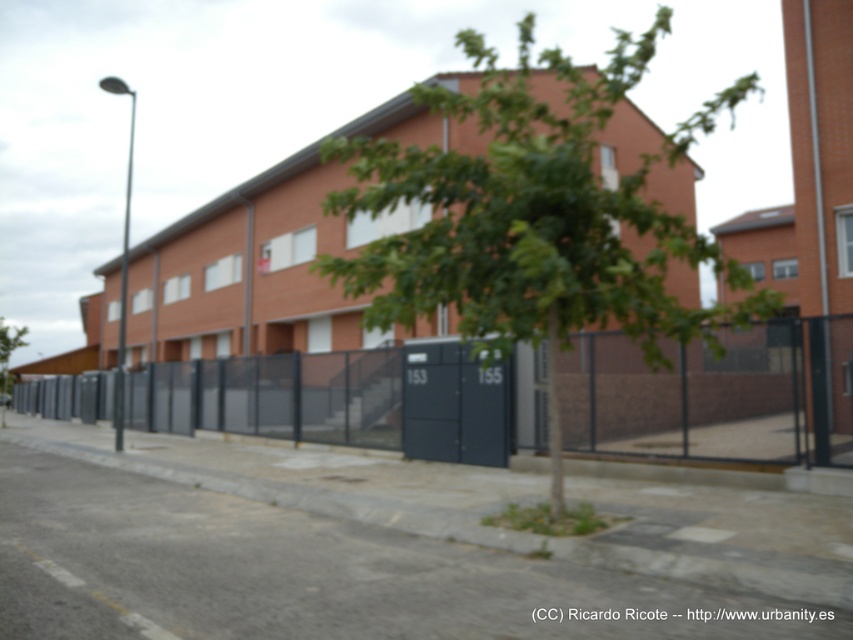
Question: Does dark gray metal fence at center have a greater width compared to green leafy tree at lower left?

Choices:
 (A) yes
 (B) no

Answer: (B)

Question: In this image, where is green leafy tree at center located relative to dark gray metal fence at center?

Choices:
 (A) left
 (B) right

Answer: (B)

Question: Does green leafy tree at center come behind green leafy tree at lower left?

Choices:
 (A) no
 (B) yes

Answer: (A)

Question: Which of the following is the closest to the observer?

Choices:
 (A) (732, 452)
 (B) (526, 113)

Answer: (B)

Question: Which point is closer to the camera taking this photo?

Choices:
 (A) (683, 456)
 (B) (0, 332)
 (C) (519, 141)

Answer: (C)

Question: Which point is farther from the camera taking this photo?

Choices:
 (A) (225, 417)
 (B) (6, 378)
 (C) (547, 260)

Answer: (B)